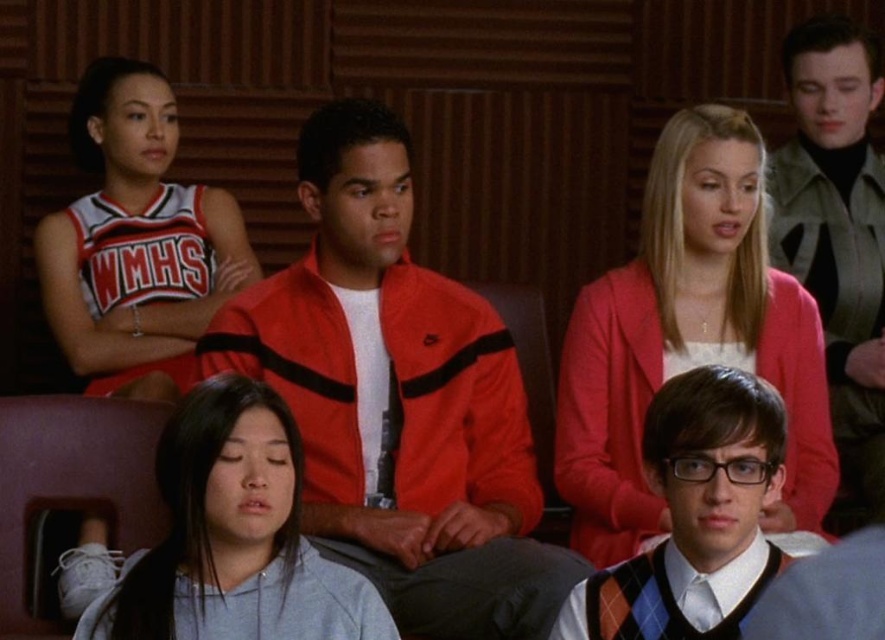
Question: Which point appears closest to the camera in this image?

Choices:
 (A) (791, 440)
 (B) (622, 624)
 (C) (190, 397)
 (D) (68, 323)

Answer: (B)

Question: Is gray woolen sweater at upper right above argyle sweater vest at center?

Choices:
 (A) no
 (B) yes

Answer: (B)

Question: Which point is closer to the camera taking this photo?

Choices:
 (A) (644, 442)
 (B) (173, 188)

Answer: (A)

Question: Can you confirm if white jersey at upper left is wider than gray cotton shirt at lower left?

Choices:
 (A) no
 (B) yes

Answer: (B)

Question: Which of these objects is positioned farthest from the pink cardigan at upper center?

Choices:
 (A) gray cotton shirt at lower left
 (B) argyle sweater vest at center
 (C) gray woolen sweater at upper right
 (D) white jersey at upper left

Answer: (D)

Question: Observing the image, what is the correct spatial positioning of matte red jacket at center in reference to white jersey at upper left?

Choices:
 (A) right
 (B) left

Answer: (A)